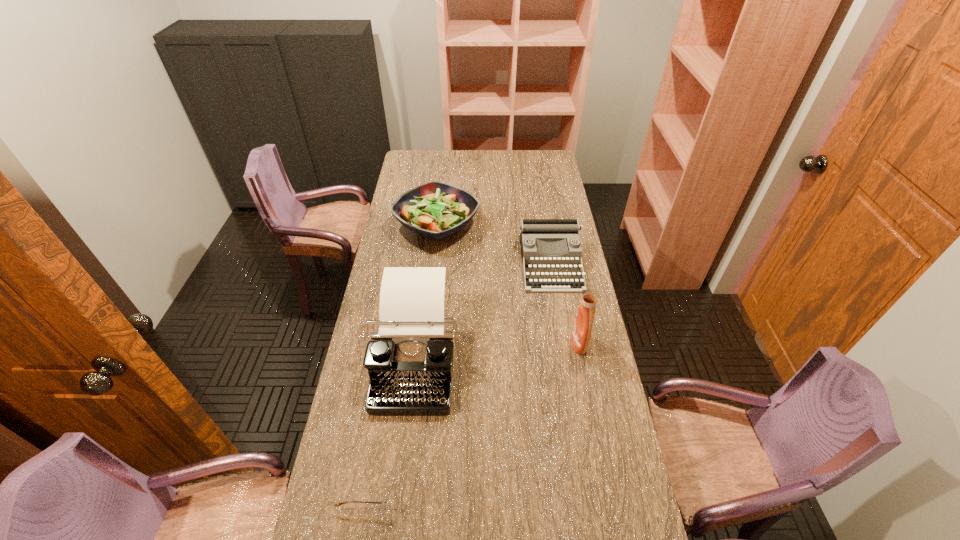
Locate an element on the screen. Image resolution: width=960 pixels, height=540 pixels. detergent is located at coordinates (582, 328).

Locate an element on the screen. the left typewriter is located at coordinates (409, 360).

You are a GUI agent. You are given a task and a screenshot of the screen. Output one action in this format:
    pyautogui.click(x=<x>, y=<y>)
    Task: Click on the nearer typewriter
    
    Given the screenshot: What is the action you would take?
    pyautogui.click(x=409, y=360)

In order to click on salad plate in this screenshot , I will do `click(436, 210)`.

Find the location of a particular element. Image resolution: width=960 pixels, height=540 pixels. the second shortest object is located at coordinates (532, 231).

I want to click on the right typewriter, so click(x=532, y=231).

Image resolution: width=960 pixels, height=540 pixels. In order to click on vacant space situated 0.110m on the front-facing side of the detergent in this screenshot , I will do `click(539, 343)`.

The height and width of the screenshot is (540, 960). What are the coordinates of `free space located on the front-facing side of the detergent` in the screenshot? It's located at (539, 343).

Where is `vacant point located 0.370m on the front-facing side of the detergent`? The image size is (960, 540). vacant point located 0.370m on the front-facing side of the detergent is located at coordinates (462, 343).

The image size is (960, 540). What are the coordinates of `free space located 0.210m on the keys of the taller typewriter` in the screenshot? It's located at [396, 491].